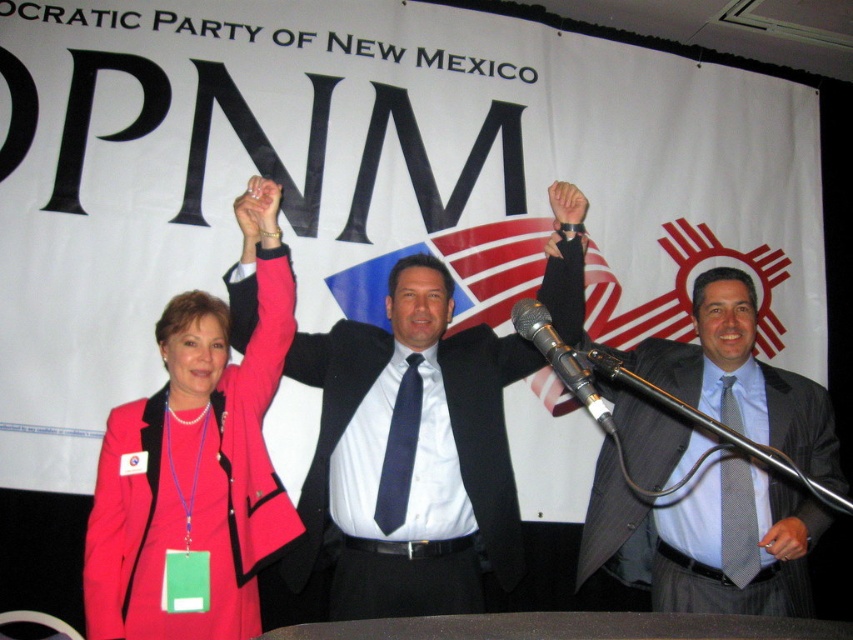
Question: Which point appears closest to the camera in this image?

Choices:
 (A) (398, 396)
 (B) (289, 509)
 (C) (706, 580)
 (D) (509, 314)

Answer: (B)

Question: Is matte black suit at center in front of metallic silver microphone at center?

Choices:
 (A) no
 (B) yes

Answer: (A)

Question: Can you confirm if matte pink blazer at left is bigger than gray pinstripe suit at center?

Choices:
 (A) yes
 (B) no

Answer: (B)

Question: Observing the image, what is the correct spatial positioning of matte pink blazer at left in reference to metallic silver microphone at center?

Choices:
 (A) below
 (B) above

Answer: (A)

Question: Which of the following is the farthest from the observer?

Choices:
 (A) (610, 413)
 (B) (413, 272)
 (C) (602, 456)

Answer: (C)

Question: Estimate the real-world distances between objects in this image. Which object is closer to the matte black suit at center?

Choices:
 (A) metallic silver microphone at center
 (B) gray pinstripe suit at center

Answer: (B)